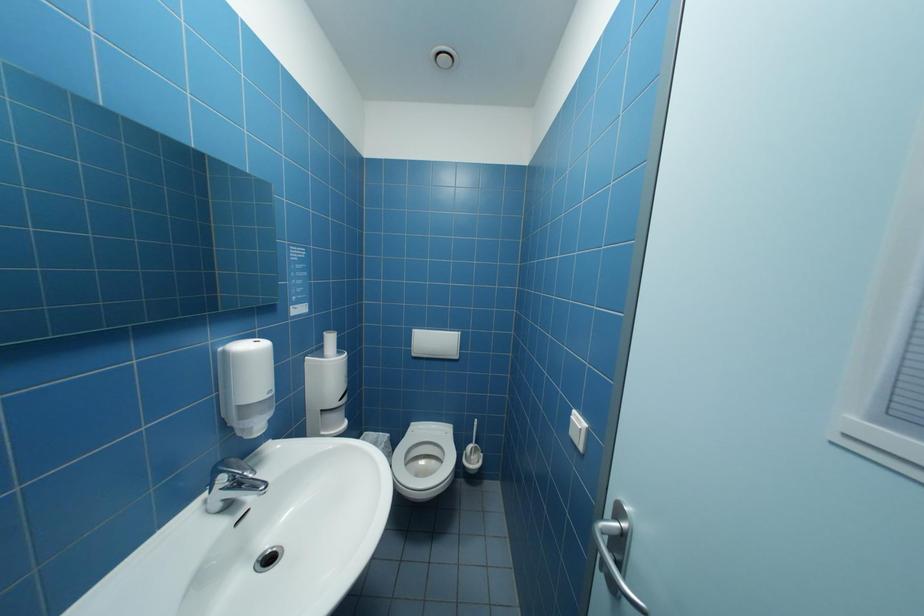
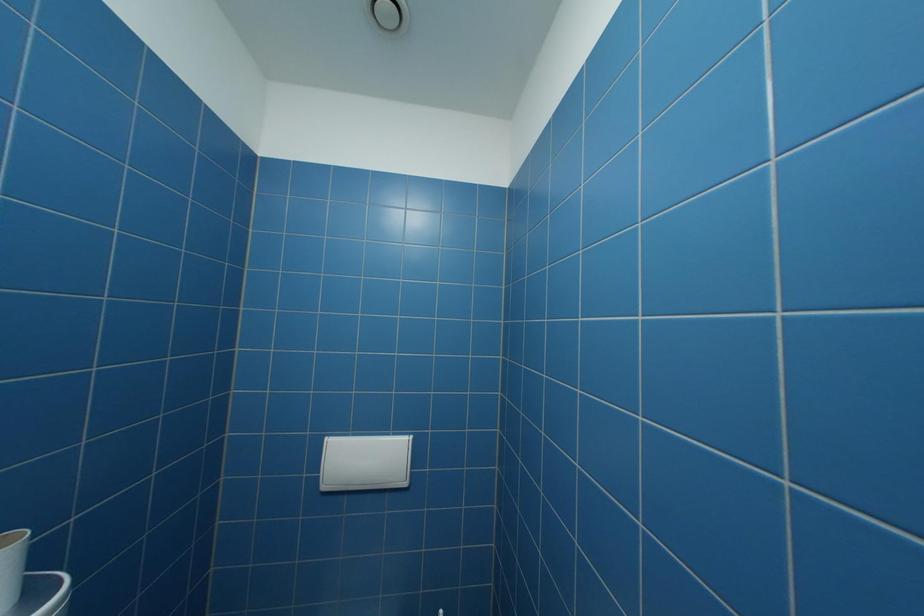
Question: How did the camera likely rotate?

Choices:
 (A) Left
 (B) Right
 (C) Up
 (D) Down

Answer: (C)